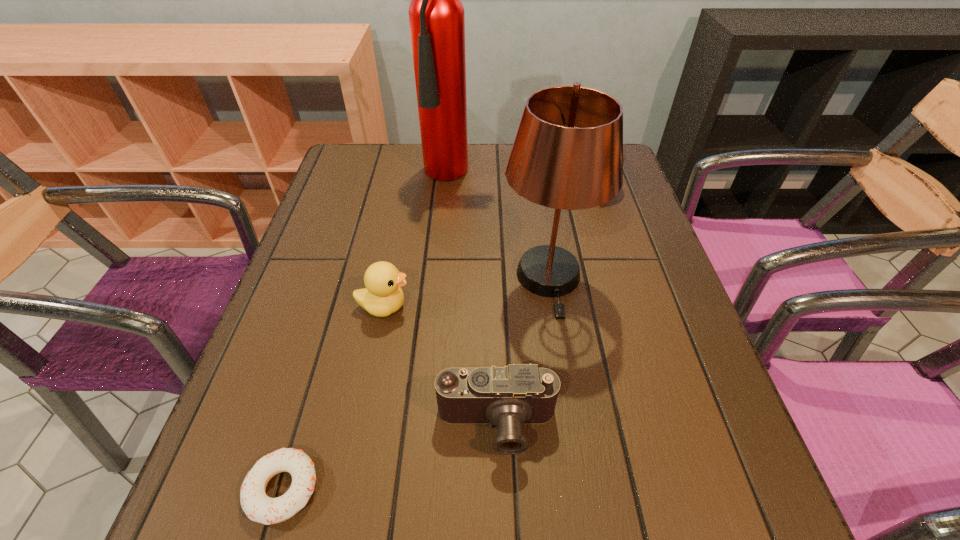
This screenshot has width=960, height=540. What are the coordinates of `object that is positioned at the near left corner` in the screenshot? It's located at (258, 507).

The height and width of the screenshot is (540, 960). Identify the location of object at the far right corner. (623, 150).

Locate an element on the screen. This screenshot has width=960, height=540. free space at the left edge is located at coordinates (357, 266).

In the image, there is a desktop. Where is `vacant space at the right edge`? vacant space at the right edge is located at coordinates (644, 367).

This screenshot has width=960, height=540. Find the location of `free region at the far left corner of the desktop`. free region at the far left corner of the desktop is located at coordinates (371, 146).

In the image, there is a desktop. At what (x,y) coordinates should I click in order to perform the action: click on vacant space at the near left corner. Please return your answer as a coordinate pair (x, y). The height and width of the screenshot is (540, 960). Looking at the image, I should click on (271, 487).

Locate an element on the screen. vacant region at the near right corner of the desktop is located at coordinates (719, 504).

The width and height of the screenshot is (960, 540). I want to click on free space between the third tallest object and the duck, so click(492, 246).

In order to click on vacant area that lies between the fifth shortest object and the shortest object in this screenshot , I will do `click(416, 383)`.

Where is `free space between the tallest object and the camera`? The height and width of the screenshot is (540, 960). free space between the tallest object and the camera is located at coordinates (478, 300).